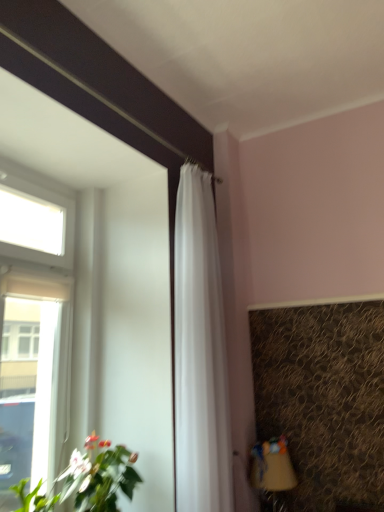
Question: In terms of height, does matte brown table lamp at lower right look taller or shorter compared to transparent glass window at upper left?

Choices:
 (A) tall
 (B) short

Answer: (B)

Question: Would you say matte brown table lamp at lower right is inside or outside transparent glass window at upper left?

Choices:
 (A) outside
 (B) inside

Answer: (A)

Question: Which object is positioned closest to the green leafy plant at lower left?

Choices:
 (A) matte brown table lamp at lower right
 (B) white sheer curtain at center
 (C) transparent glass window at upper left

Answer: (C)

Question: Estimate the real-world distances between objects in this image. Which object is closer to the green leafy plant at lower left?

Choices:
 (A) transparent glass window at upper left
 (B) white sheer curtain at center
 (C) matte brown table lamp at lower right

Answer: (A)